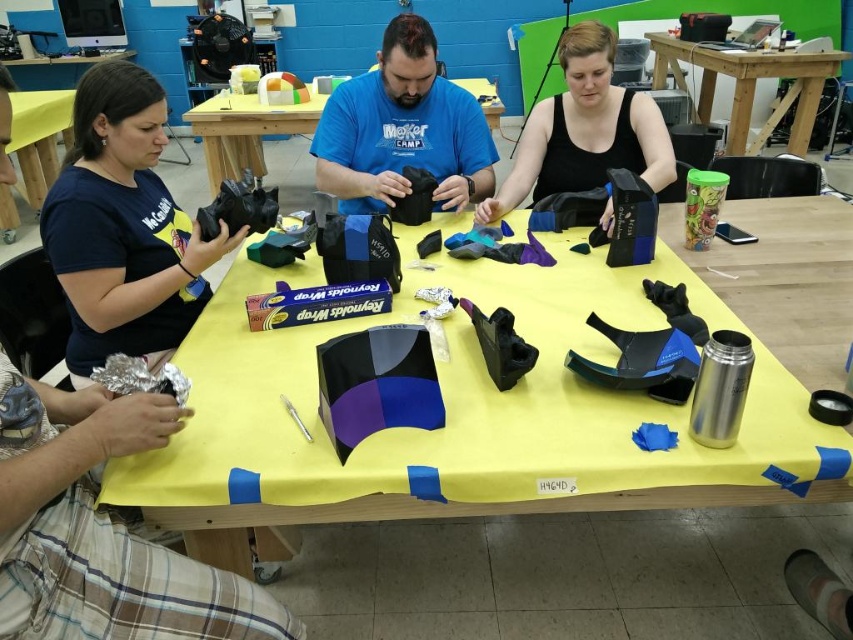
Question: Estimate the real-world distances between objects in this image. Which object is closer to the wooden table at upper right?

Choices:
 (A) matte blue shirt at center
 (B) yellow fabric at upper left
 (C) black matte mask at upper center
 (D) matte black camera at left

Answer: (C)

Question: Considering the real-world distances, which object is farthest from the matte black camera at left?

Choices:
 (A) black matte mask at upper center
 (B) matte black fabric at center

Answer: (B)

Question: Which object is the closest to the yellow fabric at upper left?

Choices:
 (A) black matte mask at upper center
 (B) matte black fabric at center
 (C) matte blue shirt at center
 (D) wooden table at upper right

Answer: (B)

Question: Does wooden table at upper right appear under matte black fabric at center?

Choices:
 (A) yes
 (B) no

Answer: (B)

Question: Does wooden table at upper right have a larger size compared to yellow fabric at upper left?

Choices:
 (A) yes
 (B) no

Answer: (A)

Question: Where is wooden table at upper right located in relation to matte black fabric at center in the image?

Choices:
 (A) below
 (B) above

Answer: (B)